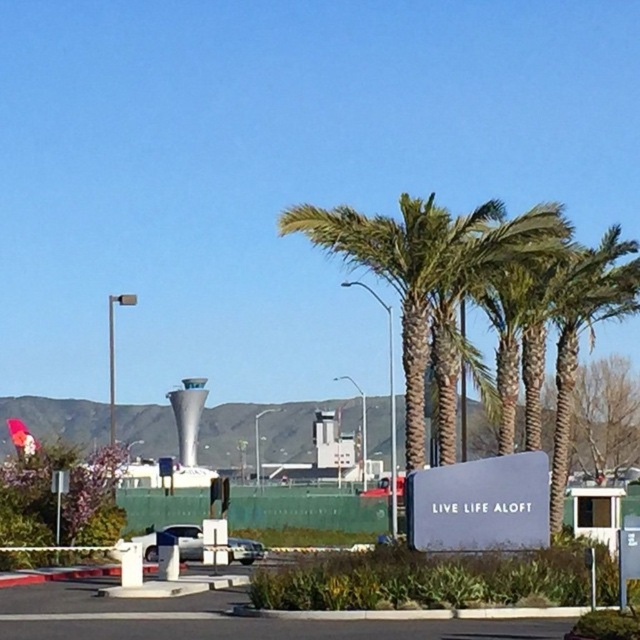
Who is higher up, white smooth control tower at center or metallic silver car at center?

Positioned higher is metallic silver car at center.

Between white smooth control tower at center and metallic silver car at center, which one has more height?

Standing taller between the two is white smooth control tower at center.

Which is behind, point (195, 378) or point (177, 524)?

The point (195, 378) is more distant.

Identify the location of white smooth control tower at center. (188, 417).

Between metallic silver car at center and metallic silver sedan at center, which one appears on the left side from the viewer's perspective?

metallic silver car at center

Is metallic silver car at center positioned at the back of metallic silver sedan at center?

No, metallic silver car at center is closer to the viewer.

Between point (154, 534) and point (250, 548), which one is positioned in front?

Positioned in front is point (154, 534).

This screenshot has width=640, height=640. I want to click on metallic silver car at center, so (186, 540).

Between point (198, 397) and point (260, 547), which one is positioned behind?

Positioned behind is point (198, 397).

Is point (186, 417) less distant than point (248, 557)?

That is False.

Describe the element at coordinates (188, 417) in the screenshot. I see `white smooth control tower at center` at that location.

You are a GUI agent. You are given a task and a screenshot of the screen. Output one action in this format:
    pyautogui.click(x=<x>, y=<y>)
    Task: Click on the white smooth control tower at center
    
    Given the screenshot: What is the action you would take?
    pyautogui.click(x=188, y=417)